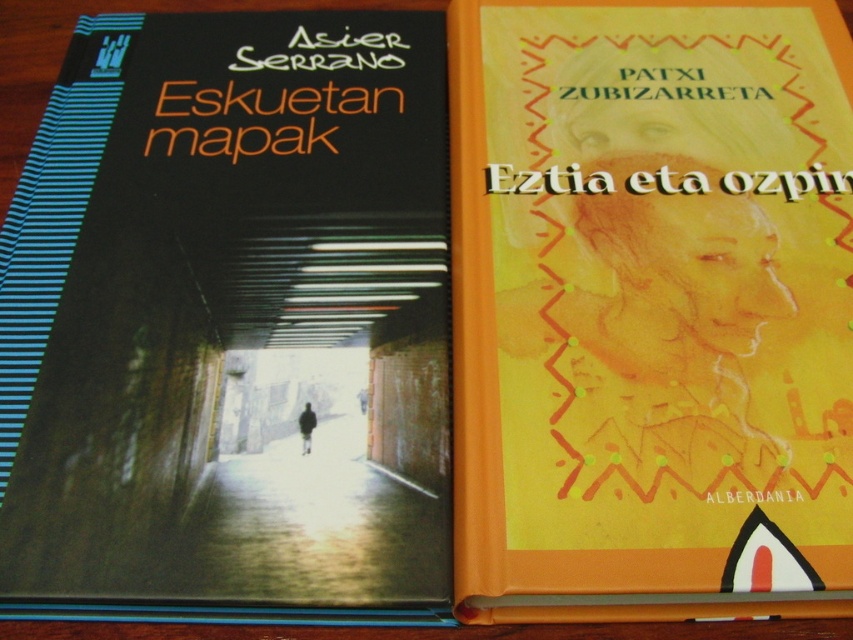
Question: In this image, where is black matte book cover at center located relative to orange matte book at right?

Choices:
 (A) left
 (B) right

Answer: (A)

Question: Is black matte book cover at center closer to camera compared to orange matte book at right?

Choices:
 (A) no
 (B) yes

Answer: (A)

Question: Which point is closer to the camera?

Choices:
 (A) (802, 515)
 (B) (115, 198)

Answer: (A)

Question: Can you confirm if black matte book cover at center is positioned below orange matte book at right?

Choices:
 (A) yes
 (B) no

Answer: (A)

Question: Which object appears farthest from the camera in this image?

Choices:
 (A) black matte book cover at center
 (B) orange matte book at right

Answer: (A)